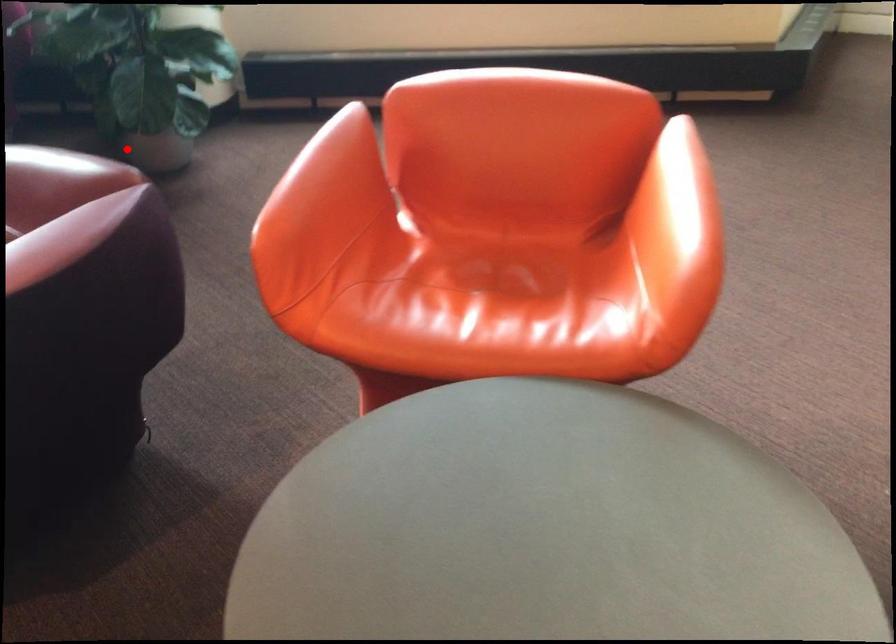
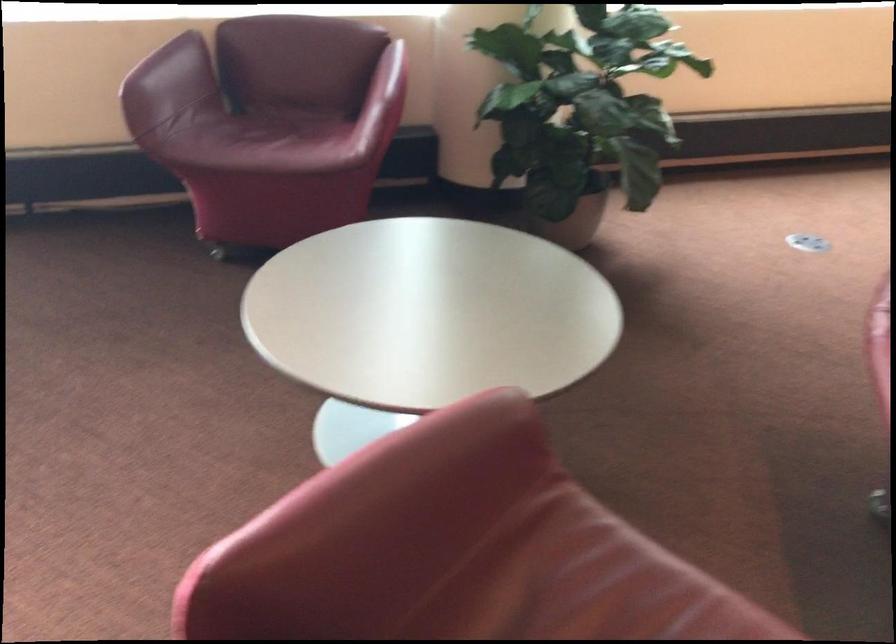
Question: I am providing you with two images of the same scene from different viewpoints. In image1, a red point is highlighted. Considering the same 3D point in image2, which of the following is correct?

Choices:
 (A) It is closer
 (B) It is farther

Answer: (A)